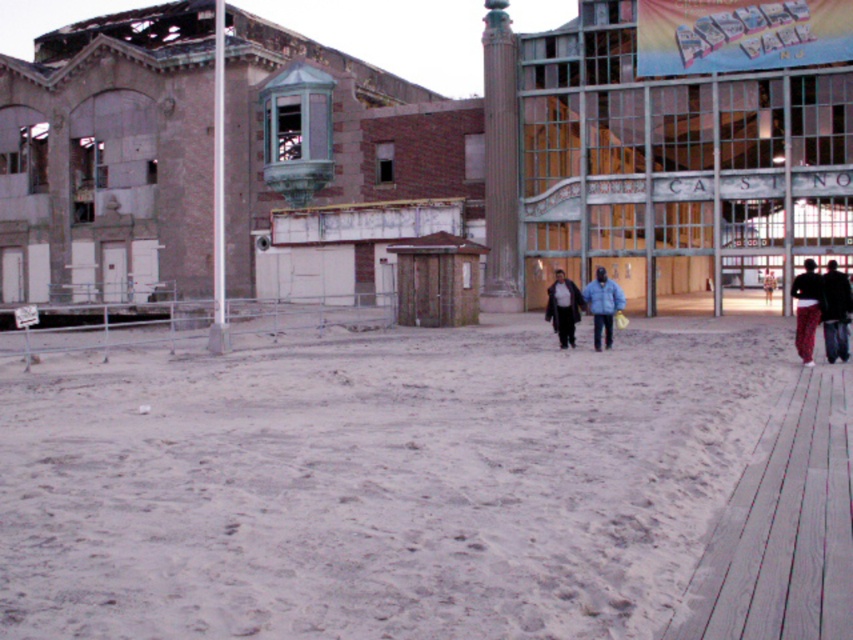
Question: Is white sandy beach at center to the left of red plaid pants at lower right from the viewer's perspective?

Choices:
 (A) yes
 (B) no

Answer: (A)

Question: Among these objects, which one is farthest from the camera?

Choices:
 (A) blue matte jacket at center
 (B) wooden planks at lower right
 (C) dark blue jacket at center
 (D) red plaid pants at lower right

Answer: (C)

Question: Which point is farther to the camera?

Choices:
 (A) dark blue jacket at center
 (B) blue matte jacket at center

Answer: (A)

Question: Estimate the real-world distances between objects in this image. Which object is farther from the white sandy beach at center?

Choices:
 (A) blue matte jacket at center
 (B) dark blue jeans at lower right
 (C) wooden planks at lower right
 (D) red plaid pants at lower right

Answer: (B)

Question: Is white sandy beach at center above red plaid pants at lower right?

Choices:
 (A) yes
 (B) no

Answer: (B)

Question: Does white sandy beach at center come behind dark blue jeans at lower right?

Choices:
 (A) no
 (B) yes

Answer: (A)